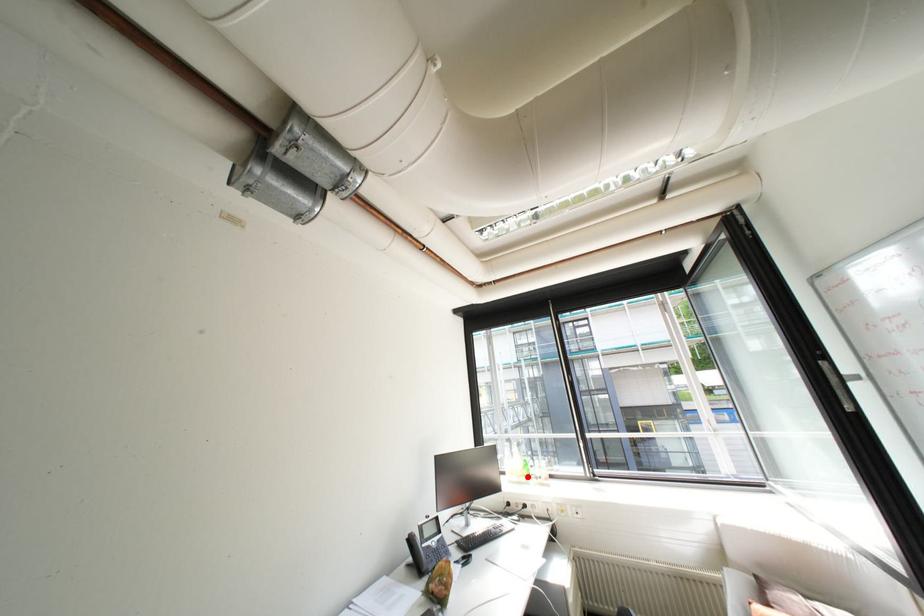
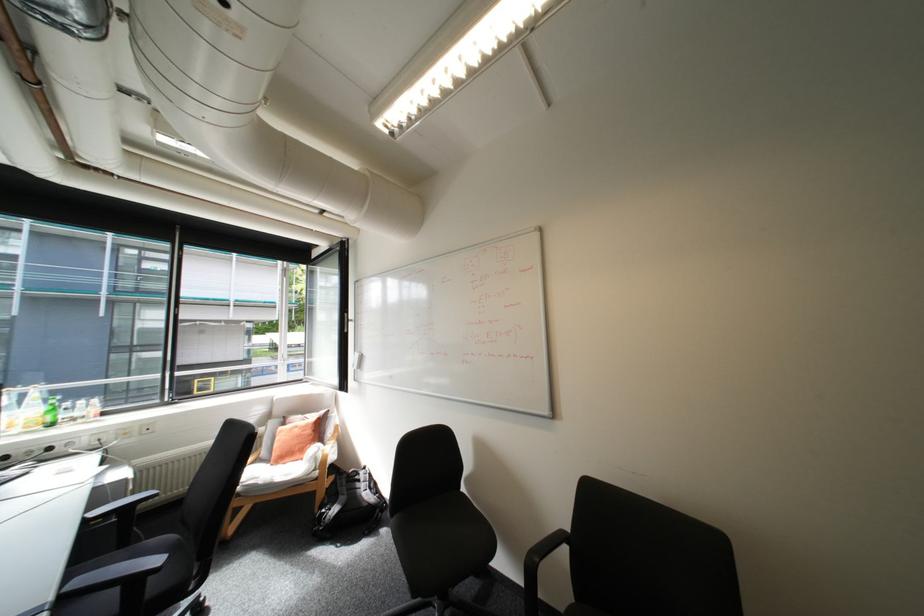
Locate, in the second image, the point that corresponds to the highlighted location in the first image.

(38, 427)